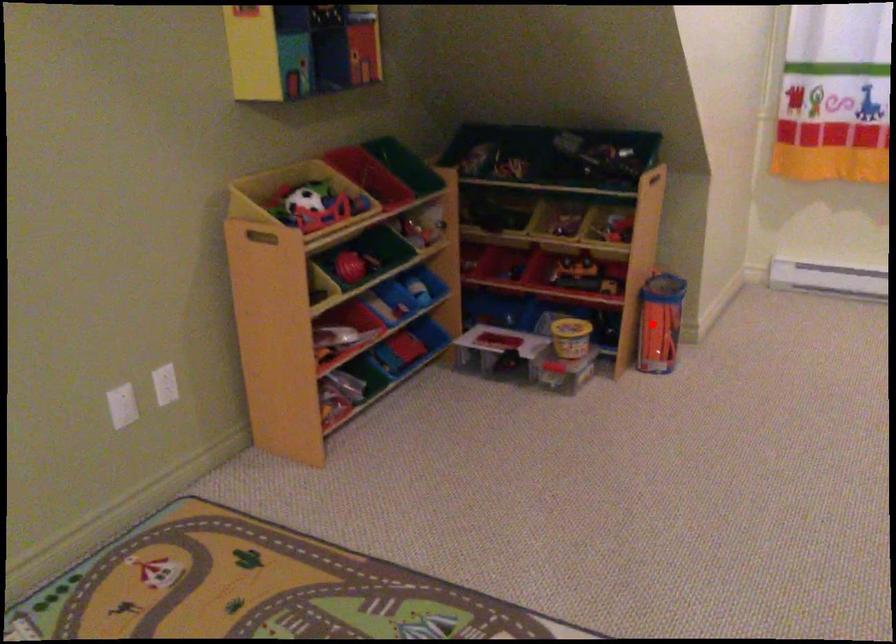
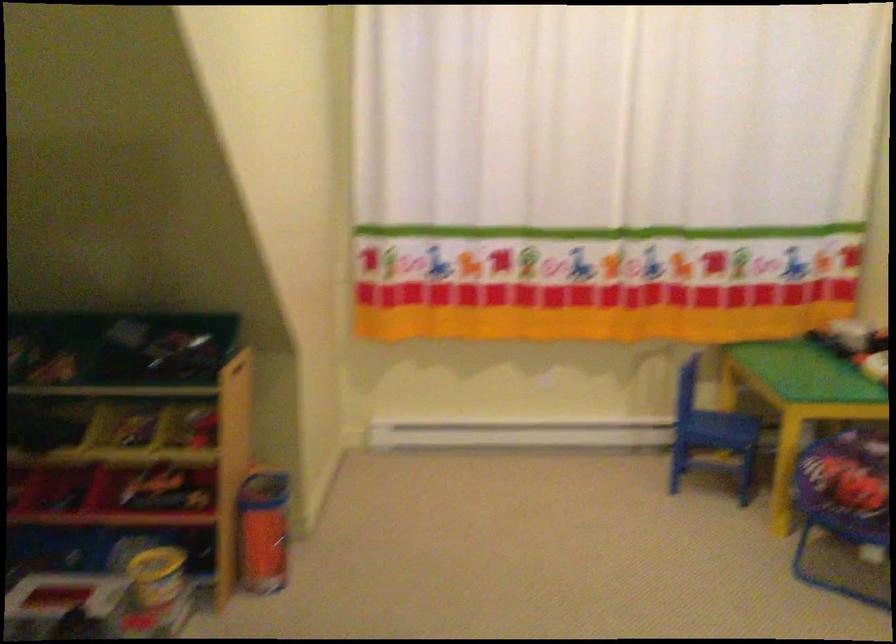
The point at the highlighted location is marked in the first image. Where is the corresponding point in the second image?

(263, 532)